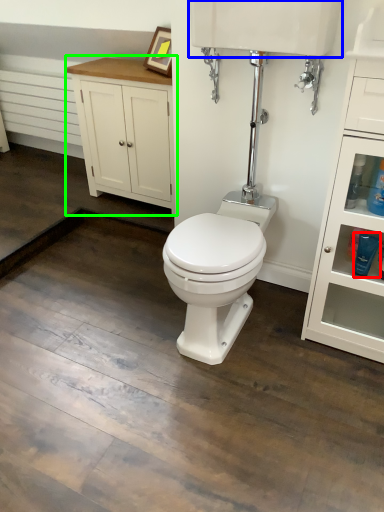
Question: Which is nearer to the toiletry (highlighted by a red box)? sink (highlighted by a blue box) or bathroom cabinet (highlighted by a green box).

Choices:
 (A) sink
 (B) bathroom cabinet

Answer: (A)